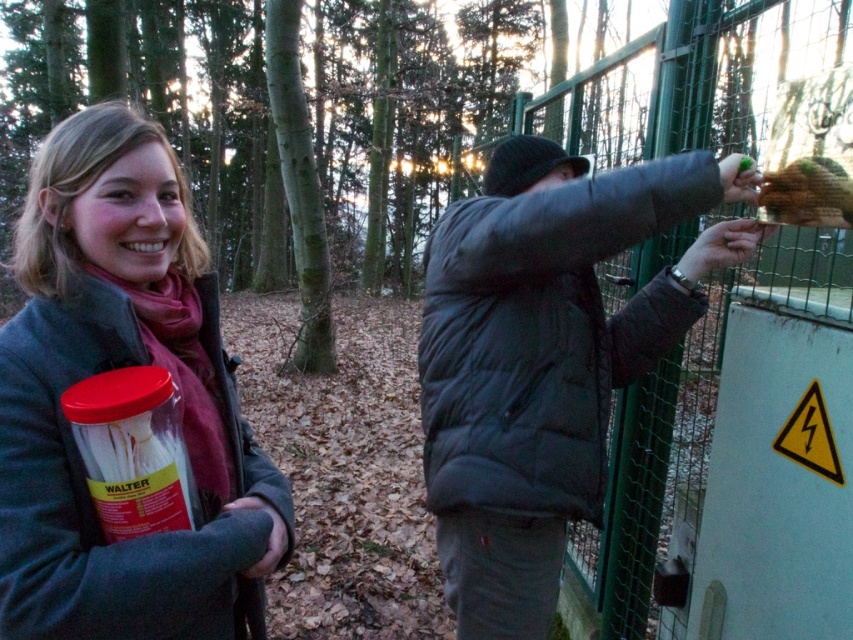
You are trying to decide which coat to take for a walk in the forest. Both the matte gray coat at center and the dark gray puffer jacket at center are available. Based on their positions in the image, which one is more likely to be yours if you were the person holding the container?

The matte gray coat at center is above the dark gray puffer jacket at center in the image, so if you were the person holding the container, the matte gray coat at center is more likely to be yours since it is positioned higher and closer to your body.

You are a photographer trying to position a matte gray coat at center for a photo shoot in the forest scene described. Given its current coordinates at point 0.575, 0.138, where exactly should you place it to ensure it is centered both horizontally and vertically in the frame?

To center the matte gray coat at center both horizontally and vertically in the frame, it should be positioned at the coordinates (x=426, y=320), which is the exact center point of the image.

You are a delivery person who needs to place the green matte food at upper right onto the dark gray puffer jacket at center. Can you do this without moving either object?

The distance between the dark gray puffer jacket at center and the green matte food at upper right is 18.06 inches, so you can place the green matte food at upper right onto the dark gray puffer jacket at center without moving either object since the distance is manageable.